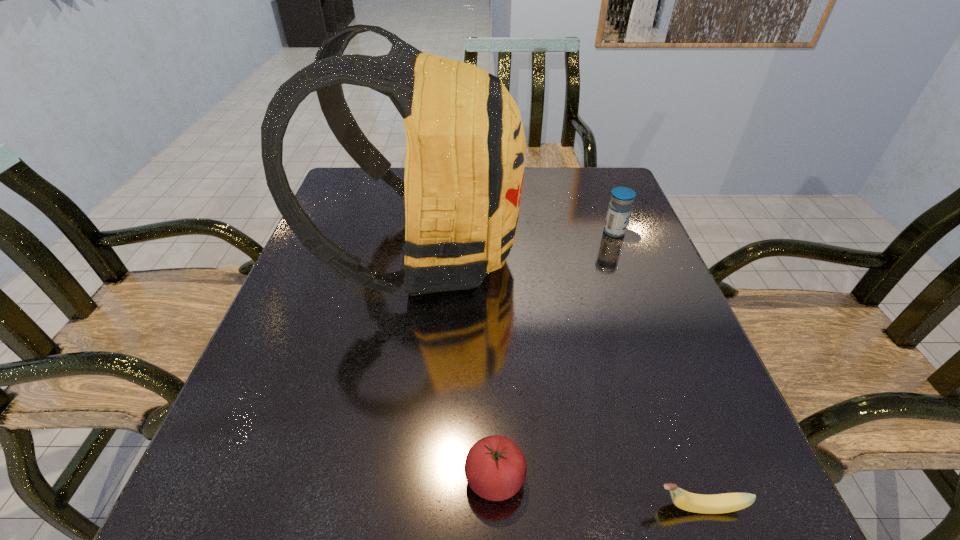
This screenshot has width=960, height=540. I want to click on free space between the tallest object and the medicine, so click(519, 243).

The width and height of the screenshot is (960, 540). I want to click on vacant area between the third tallest object and the banana, so click(597, 492).

This screenshot has width=960, height=540. Find the location of `unoccupied position between the third shortest object and the tomato`. unoccupied position between the third shortest object and the tomato is located at coordinates (x=555, y=355).

Where is `unoccupied position between the tallest object and the banana`? This screenshot has width=960, height=540. unoccupied position between the tallest object and the banana is located at coordinates (562, 381).

Identify the location of object identified as the third closest to the medicine. Image resolution: width=960 pixels, height=540 pixels. (728, 502).

At what (x,y) coordinates should I click in order to perform the action: click on object that is the third closest one to the medicine. Please return your answer as a coordinate pair (x, y). The image size is (960, 540). Looking at the image, I should click on (728, 502).

I want to click on free space that satisfies the following two spatial constraints: 1. on the front-facing side of the tallest object; 2. on the back side of the third tallest object, so click(391, 478).

Locate an element on the screen. The height and width of the screenshot is (540, 960). blank area in the image that satisfies the following two spatial constraints: 1. on the back side of the third shortest object; 2. on the right side of the second shortest object is located at coordinates (489, 232).

At what (x,y) coordinates should I click in order to perform the action: click on vacant region that satisfies the following two spatial constraints: 1. on the front-facing side of the backpack; 2. on the back side of the tomato. Please return your answer as a coordinate pair (x, y). The width and height of the screenshot is (960, 540). Looking at the image, I should click on (391, 478).